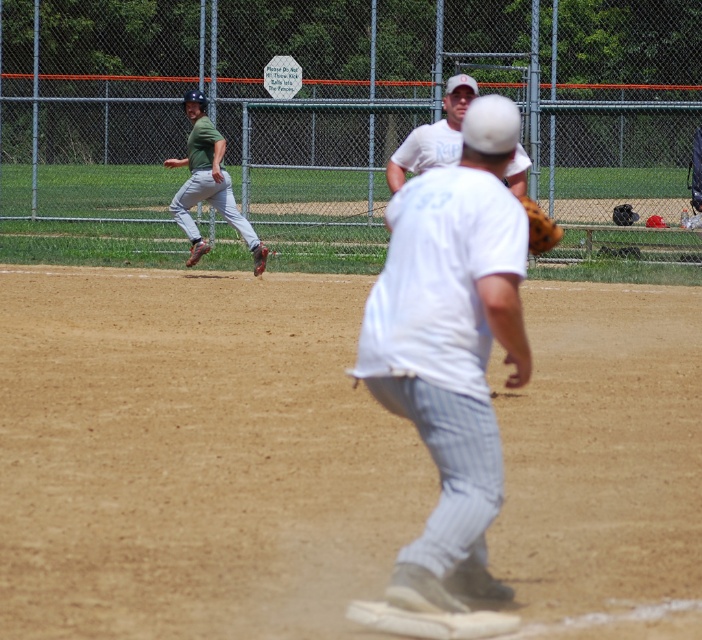
Does white pinstriped pants at center have a lesser height compared to green fabric baseball uniform at upper left?

Yes, white pinstriped pants at center is shorter than green fabric baseball uniform at upper left.

Measure the distance between white pinstriped pants at center and camera.

white pinstriped pants at center and camera are 18.87 feet apart from each other.

Is point (482, 100) positioned in front of point (190, 118)?

Yes, point (482, 100) is closer to viewer.

This screenshot has width=702, height=640. Identify the location of white pinstriped pants at center. (451, 348).

Between white pinstriped pants at center and white cotton shirt at upper center, which one is positioned higher?

white cotton shirt at upper center is above.

Who is more distant from viewer, (468, 419) or (416, 132)?

Point (416, 132)

You are a GUI agent. You are given a task and a screenshot of the screen. Output one action in this format:
    pyautogui.click(x=<x>, y=<y>)
    Task: Click on the white pinstriped pants at center
    The width and height of the screenshot is (702, 640).
    Given the screenshot: What is the action you would take?
    pyautogui.click(x=451, y=348)

The image size is (702, 640). I want to click on white pinstriped pants at center, so click(451, 348).

Describe the element at coordinates (206, 182) in the screenshot. The width and height of the screenshot is (702, 640). I see `green fabric baseball uniform at upper left` at that location.

Is point (197, 90) farther from camera compared to point (529, 221)?

Yes, point (197, 90) is behind point (529, 221).

At what (x,y) coordinates should I click in order to perform the action: click on green fabric baseball uniform at upper left. Please return your answer as a coordinate pair (x, y). The width and height of the screenshot is (702, 640). Looking at the image, I should click on (206, 182).